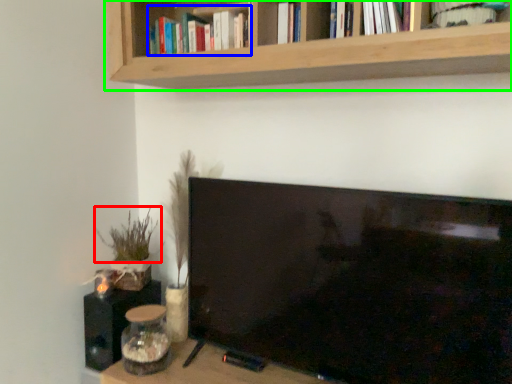
Question: Which object is the farthest from plant (highlighted by a red box)? Choose among these: book (highlighted by a blue box) or shelf (highlighted by a green box).

Choices:
 (A) book
 (B) shelf

Answer: (B)